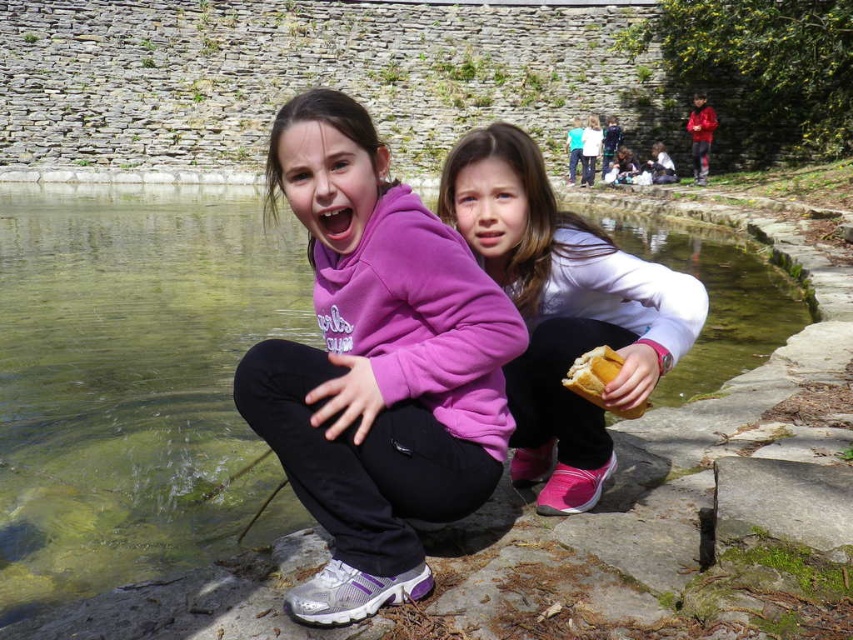
You are a photographer trying to capture both the white matte jacket at center and the golden bread at lower center in the same frame. Based on their sizes, which object should you focus on first to ensure both are in focus?

The white matte jacket at center is much taller than the golden bread at lower center, so you should focus on the white matte jacket at center first to ensure both are in focus.

You are a photographer trying to capture the reflection of the white matte jacket at center in the clear water at lake center. Based on the scene description, can you confirm if the jacket is positioned in a way that its reflection would be visible in the water?

The clear water at lake center is above white matte jacket at center, so the jacket is below the water. Since reflections require the object to be above the reflective surface, the reflection would not be visible.

You are trying to locate the clear water at lake center in the image. According to the coordinates provided, where exactly is it positioned?

The clear water at lake center is located at the coordinates point (131, 380).